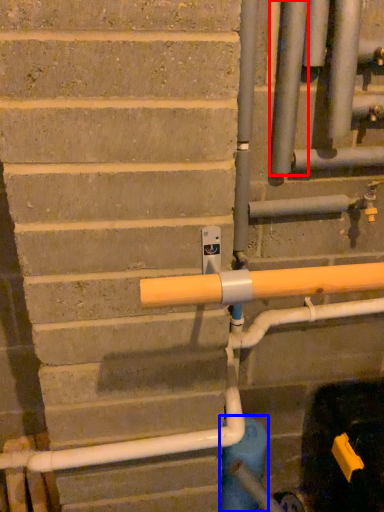
Question: Which point is further to the camera, pipe (highlighted by a red box) or water pipe (highlighted by a blue box)?

Choices:
 (A) pipe
 (B) water pipe

Answer: (B)